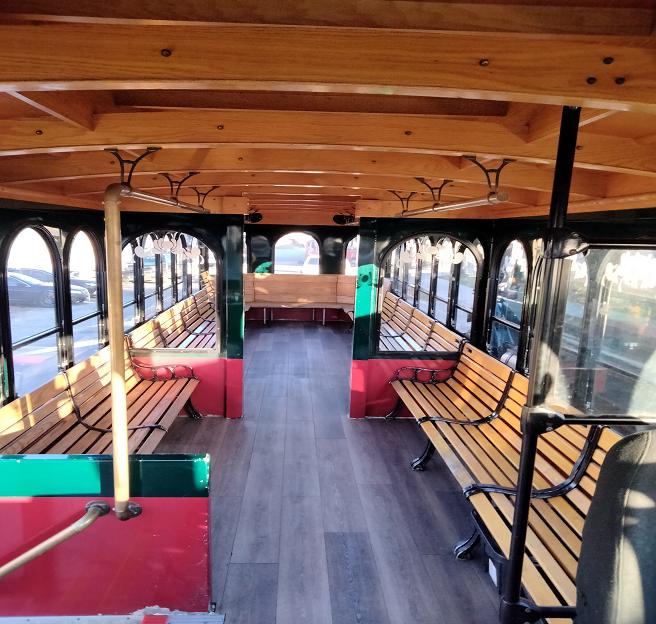
Image resolution: width=656 pixels, height=624 pixels. I want to click on trolley (interior), so [x=298, y=253].